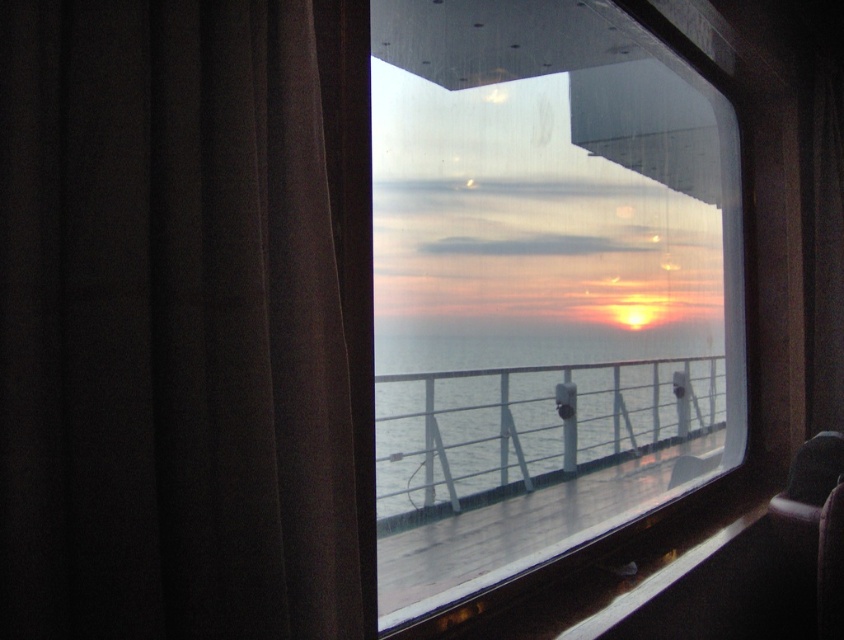
You are holding a camera and want to take a photo of the sunset through the transparent glass window at center. Considering the distance between the camera and the window, can you focus the camera to capture the sunset clearly?

The transparent glass window at center and camera are 4.75 feet apart. Since most cameras can focus clearly at distances greater than a few inches, the 4.75 feet distance should allow for a clear photo of the sunset through the window.

You are standing inside a ship cabin and want to open the window to get a better view of the clear water at center. However, the brown fabric curtain at left is blocking your access to the window. Can you reach around the curtain to open the window without moving it? Please provide your reasoning based on the distance between the two objects.

The brown fabric curtain at left and clear water at center are 27.65 inches apart. Since the curtain is blocking access to the window, but there is a gap of nearly 28 inches between them, you should be able to reach around the curtain to open the window without needing to move it.

You are standing inside the ship cabin looking through the window. There is a point marked at coordinates (169, 326). What object is located at that point?

The point at coordinates (169, 326) marks the brown fabric curtain at left.